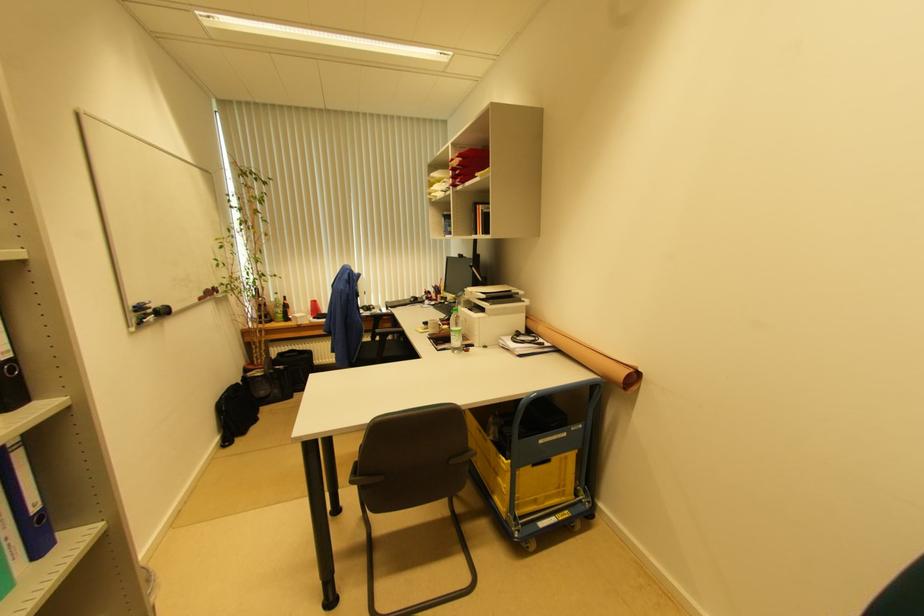
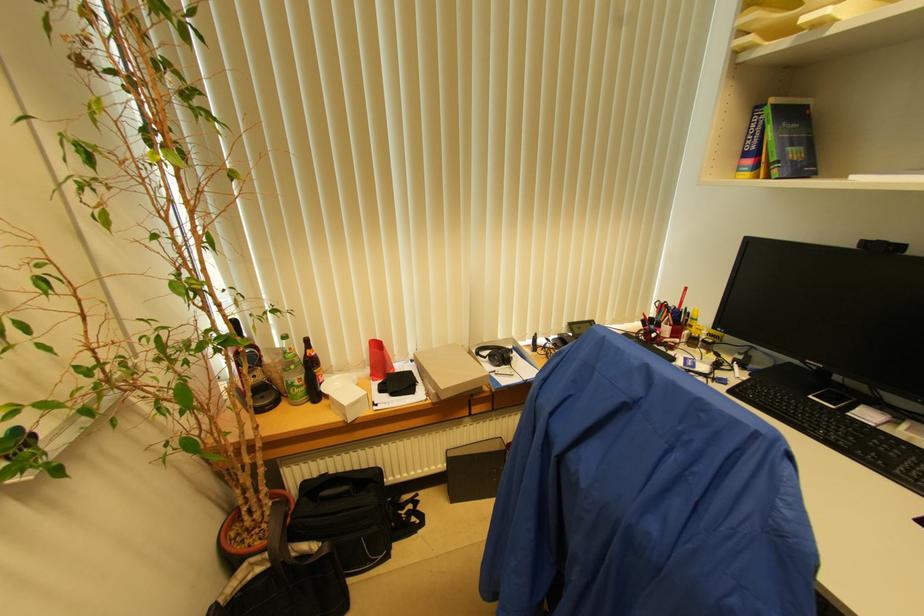
What movement of the cameraman would produce the second image?

The cameraman walked toward left, forward.